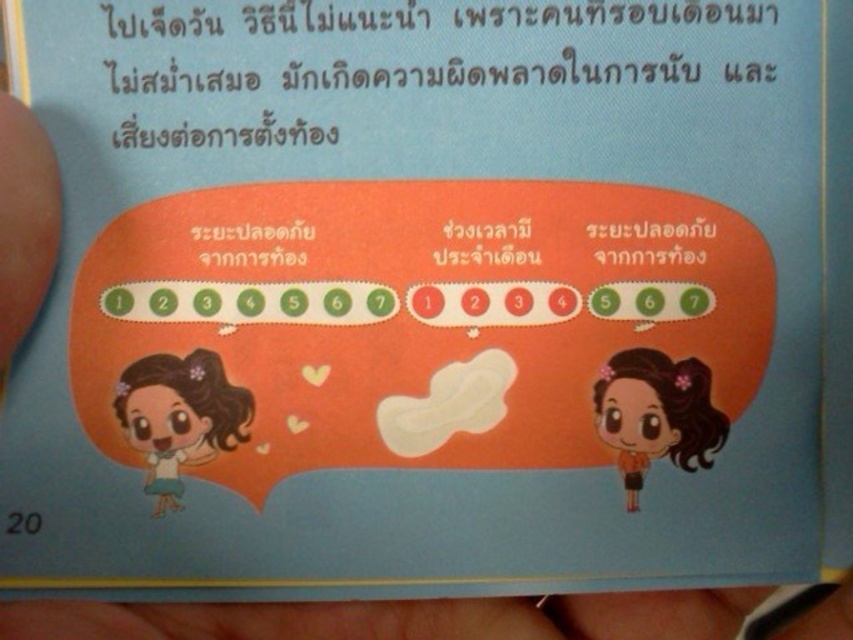
You are a stylist looking at a client with matte brown hair at left and orange matte hair at center. Which hair color would you recommend to a client wanting to balance their look?

The matte brown hair at left is larger in size than the orange matte hair at center, so to balance the look, you could suggest darkening the orange matte hair at center to match the matte brown hair at left or lighten the matte brown hair at left to complement the orange matte hair at center.

You are looking at a picture of two characters with different hairstyles. The matte brown hair at left and the orange matte hair at center are part of their outfits. Which hairstyle is shorter?

The matte brown hair at left is shorter than the orange matte hair at center.

You are a hair stylist who needs to style two clients with different hair colors. The first client has matte brown hair at left and the second has orange matte hair at center. The distance between them is 41.49 centimeters. If your styling station is 1 meter away from the nearest client, can you style both clients without moving your station?

The matte brown hair at left and orange matte hair at center are 41.49 centimeters apart. Since the styling station is 1 meter away from the nearest client, the total distance from the station to the farthest client would be 1 meter plus 41.49 centimeters, which is 141.49 centimeters. As long as the styling station can reach up to at least 141.49 centimeters, you can style both clients without moving. However, if the station only covers 1 meter, moving would be necessary.